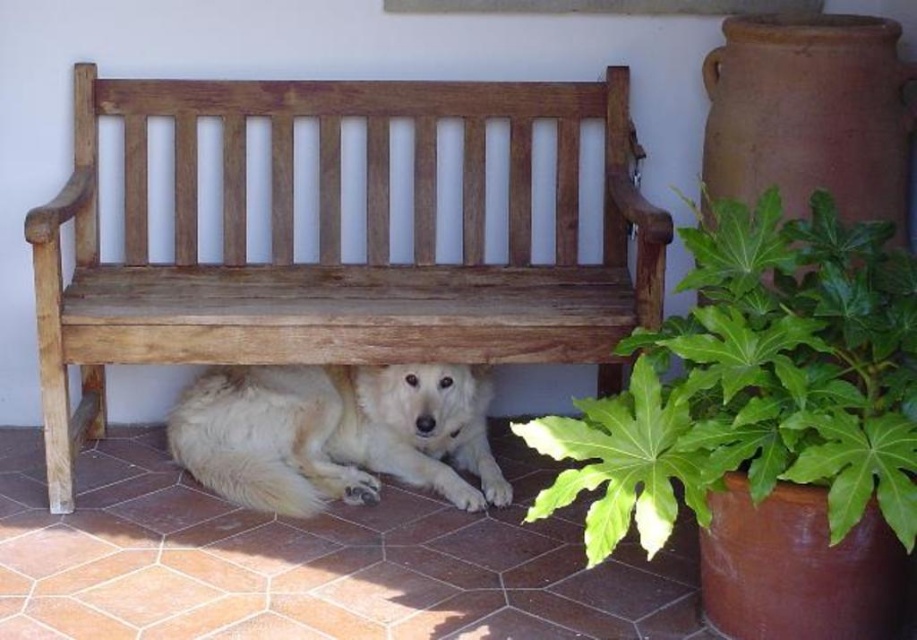
You are a photographer setting up a tripod to take a portrait of the white fluffy dog at under bench. The wooden bench at center is blocking your view. Can you move the tripod closer to the dog to get a clear shot without moving the dog?

The wooden bench at center is larger than the white fluffy dog at under bench, so there might be enough space between them to move the tripod closer to the dog while avoiding the bench. However, the exact feasibility depends on the distance between the bench and the dog, which isn

You are trying to place a small potted plant that is 15 cm wide. You see the wooden bench at center and the green leafy plant at lower right in the scene. Which object can the potted plant fit next to without overlapping?

The potted plant can fit next to the green leafy plant at lower right because the wooden bench at center is wider than the green leafy plant at lower right, so there is more space available next to the smaller plant.